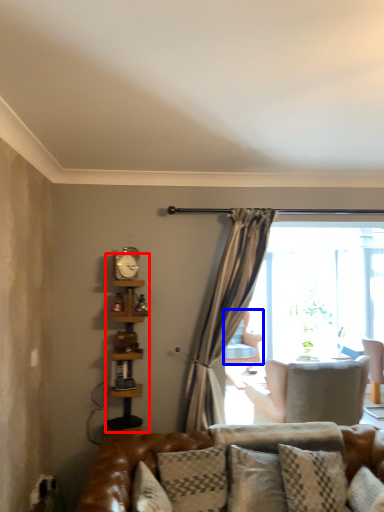
Question: Which point is further to the camera, bookshelf (highlighted by a red box) or chair (highlighted by a blue box)?

Choices:
 (A) bookshelf
 (B) chair

Answer: (B)